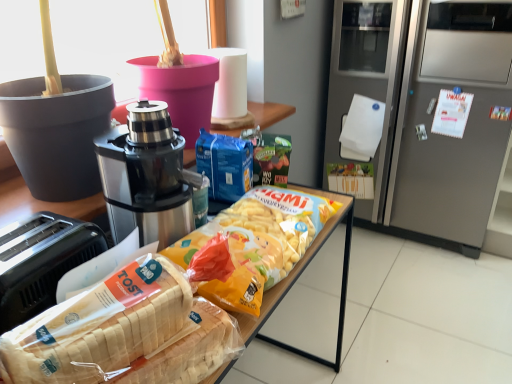
Question: From the image's perspective, would you say stainless steel coffee maker at center is positioned over white glossy refrigerator at right?

Choices:
 (A) yes
 (B) no

Answer: (B)

Question: From a real-world perspective, is stainless steel coffee maker at center over white glossy refrigerator at right?

Choices:
 (A) yes
 (B) no

Answer: (B)

Question: Can you confirm if stainless steel coffee maker at center is bigger than white glossy refrigerator at right?

Choices:
 (A) no
 (B) yes

Answer: (A)

Question: Can you confirm if stainless steel coffee maker at center is positioned to the right of white glossy refrigerator at right?

Choices:
 (A) yes
 (B) no

Answer: (A)

Question: Is stainless steel coffee maker at center oriented towards white glossy refrigerator at right?

Choices:
 (A) no
 (B) yes

Answer: (B)

Question: Would you say stainless steel coffee maker at center contains white glossy refrigerator at right?

Choices:
 (A) yes
 (B) no

Answer: (B)

Question: Is white glossy refrigerator at right at the back of white plastic bread at lower left?

Choices:
 (A) no
 (B) yes

Answer: (B)

Question: Considering the relative positions of white plastic bread at lower left and white glossy refrigerator at right in the image provided, is white plastic bread at lower left to the right of white glossy refrigerator at right from the viewer's perspective?

Choices:
 (A) no
 (B) yes

Answer: (B)

Question: Is white plastic bread at lower left shorter than white glossy refrigerator at right?

Choices:
 (A) no
 (B) yes

Answer: (B)

Question: Can you confirm if white plastic bread at lower left is taller than white glossy refrigerator at right?

Choices:
 (A) no
 (B) yes

Answer: (A)

Question: From a real-world perspective, is white plastic bread at lower left located beneath white glossy refrigerator at right?

Choices:
 (A) no
 (B) yes

Answer: (B)

Question: Is white plastic bread at lower left positioned far away from white glossy refrigerator at right?

Choices:
 (A) no
 (B) yes

Answer: (A)

Question: From the image's perspective, is white plastic bread at lower left under satin silver refrigerator at right?

Choices:
 (A) yes
 (B) no

Answer: (A)